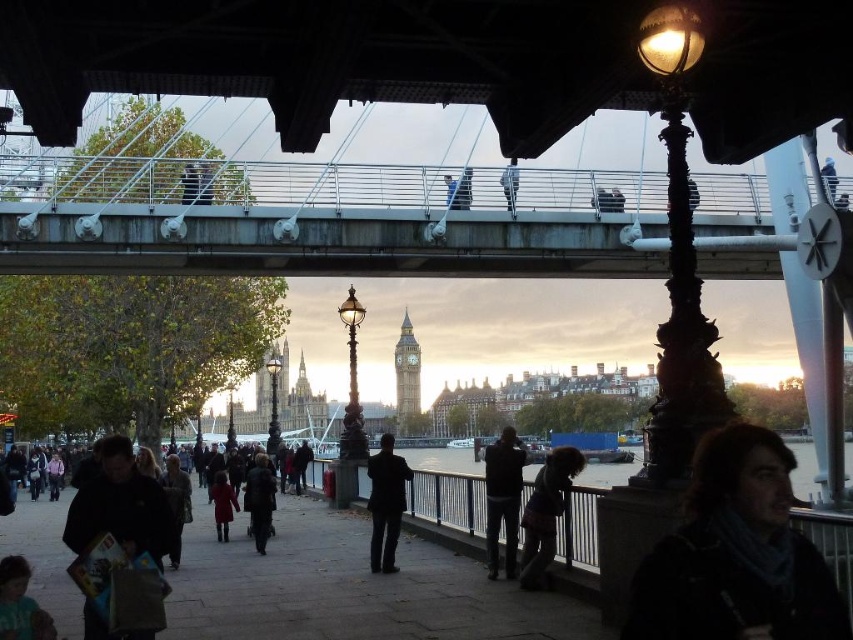
Locate an element on the screen. This screenshot has height=640, width=853. light blue denim jacket at lower left is located at coordinates (20, 604).

Can you confirm if light blue denim jacket at lower left is positioned to the right of brown textured coat at center?

Incorrect, light blue denim jacket at lower left is not on the right side of brown textured coat at center.

Is point (47, 632) in front of point (180, 518)?

Yes.

Image resolution: width=853 pixels, height=640 pixels. Identify the location of light blue denim jacket at lower left. pos(20,604).

Can you confirm if metallic gray bridge at upper center is shorter than brown textured coat at center?

Incorrect, metallic gray bridge at upper center's height does not fall short of brown textured coat at center's.

Who is positioned more to the right, metallic gray bridge at upper center or brown textured coat at center?

metallic gray bridge at upper center

Between point (299, 198) and point (178, 486), which one is positioned in front?

Point (178, 486) is more forward.

Where is `metallic gray bridge at upper center`? This screenshot has width=853, height=640. metallic gray bridge at upper center is located at coordinates (323, 220).

Is golden stone clock tower at center above dark gray jacket at center?

Yes.

Who is more forward, (x=401, y=413) or (x=271, y=474)?

Point (x=271, y=474) is in front.

You are a GUI agent. You are given a task and a screenshot of the screen. Output one action in this format:
    pyautogui.click(x=<x>, y=<y>)
    Task: Click on the golden stone clock tower at center
    The width and height of the screenshot is (853, 640).
    Given the screenshot: What is the action you would take?
    pyautogui.click(x=405, y=372)

Where is `golden stone clock tower at center`? golden stone clock tower at center is located at coordinates (405, 372).